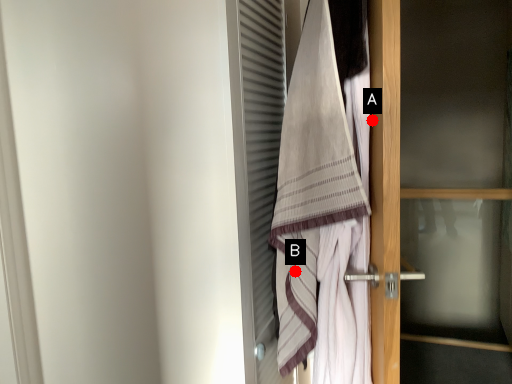
Question: Two points are circled on the image, labeled by A and B beside each circle. Which point is closer to the camera?

Choices:
 (A) A is closer
 (B) B is closer

Answer: (A)